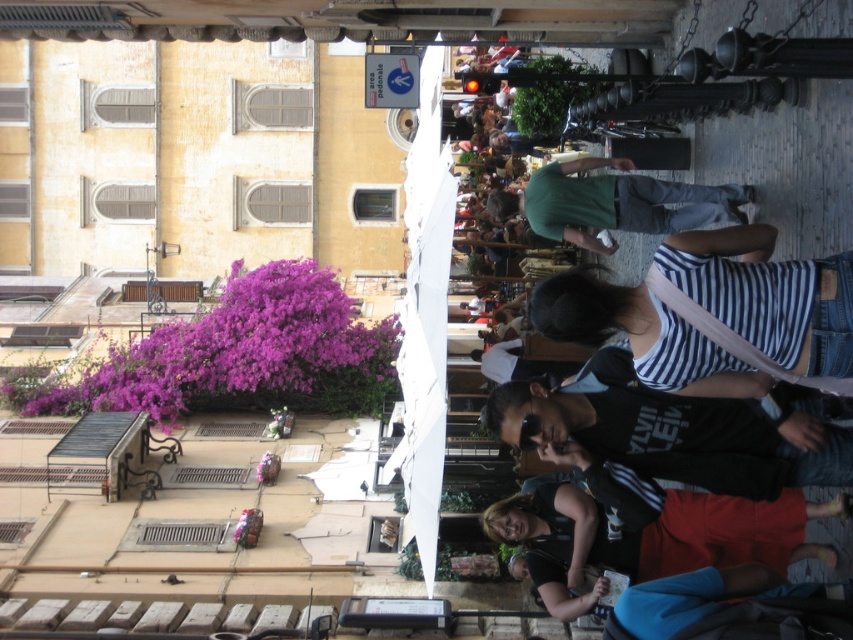
This screenshot has width=853, height=640. Identify the location of red skirt at lower right. (648, 538).

Which is more to the left, red skirt at lower right or green fabric shirt at center?

From the viewer's perspective, red skirt at lower right appears more on the left side.

The image size is (853, 640). I want to click on red skirt at lower right, so click(x=648, y=538).

Can you confirm if striped cotton shirt at center is bigger than red skirt at lower right?

Actually, striped cotton shirt at center might be smaller than red skirt at lower right.

What are the coordinates of `striped cotton shirt at center` in the screenshot? It's located at (704, 314).

Where is `striped cotton shirt at center`? The width and height of the screenshot is (853, 640). striped cotton shirt at center is located at coordinates 704,314.

The width and height of the screenshot is (853, 640). What do you see at coordinates (704, 314) in the screenshot?
I see `striped cotton shirt at center` at bounding box center [704, 314].

Can you confirm if striped cotton shirt at center is taller than green fabric shirt at center?

Incorrect, striped cotton shirt at center's height is not larger of green fabric shirt at center's.

Is point (669, 250) closer to viewer compared to point (592, 164)?

Yes, it is in front of point (592, 164).

You are a GUI agent. You are given a task and a screenshot of the screen. Output one action in this format:
    pyautogui.click(x=<x>, y=<y>)
    Task: Click on the striped cotton shirt at center
    
    Given the screenshot: What is the action you would take?
    pyautogui.click(x=704, y=314)